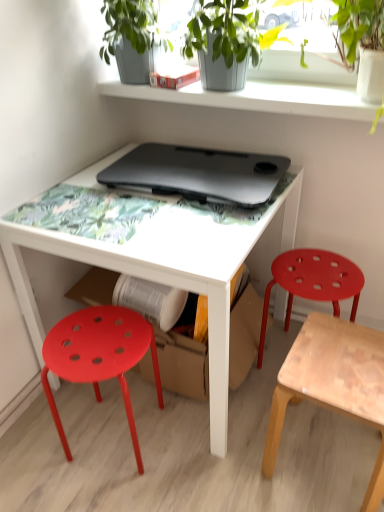
Locate an element on the screen. The height and width of the screenshot is (512, 384). vacant area that lies to the right of matte plastic stool at lower left, the 1th stool from the left is located at coordinates (192, 450).